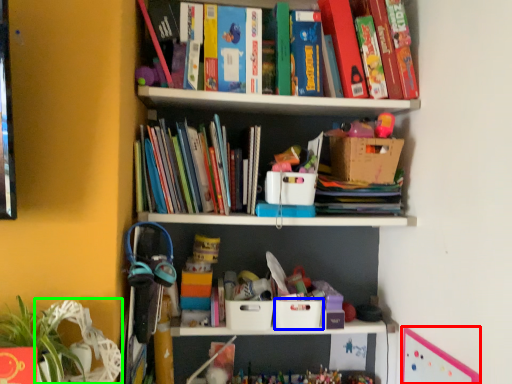
Question: Which object is the closest to the bulletin board (highlighted by a red box)? Choose among these: storage box (highlighted by a blue box) or swivel chair (highlighted by a green box).

Choices:
 (A) storage box
 (B) swivel chair

Answer: (A)